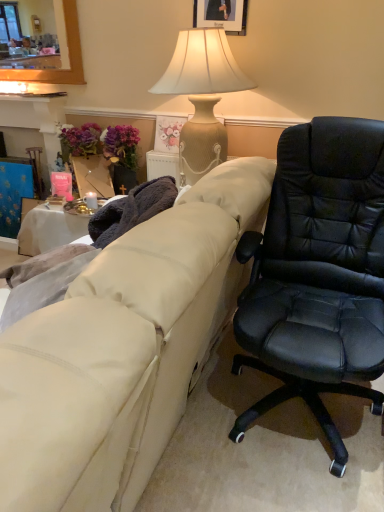
Question: Considering the positions of beige fabric couch at center and purple fabric at left in the image, is beige fabric couch at center bigger or smaller than purple fabric at left?

Choices:
 (A) small
 (B) big

Answer: (B)

Question: From the image's perspective, relative to purple fabric at left, is beige fabric couch at center above or below?

Choices:
 (A) below
 (B) above

Answer: (A)

Question: Which is nearer to the purple fabric at left?

Choices:
 (A) wooden picture frame at upper center
 (B) beige textured lamp at upper center
 (C) beige fabric couch at center

Answer: (B)

Question: Based on their relative distances, which object is nearer to the beige fabric couch at center?

Choices:
 (A) purple fabric at left
 (B) wooden picture frame at upper center
 (C) beige textured lamp at upper center

Answer: (C)